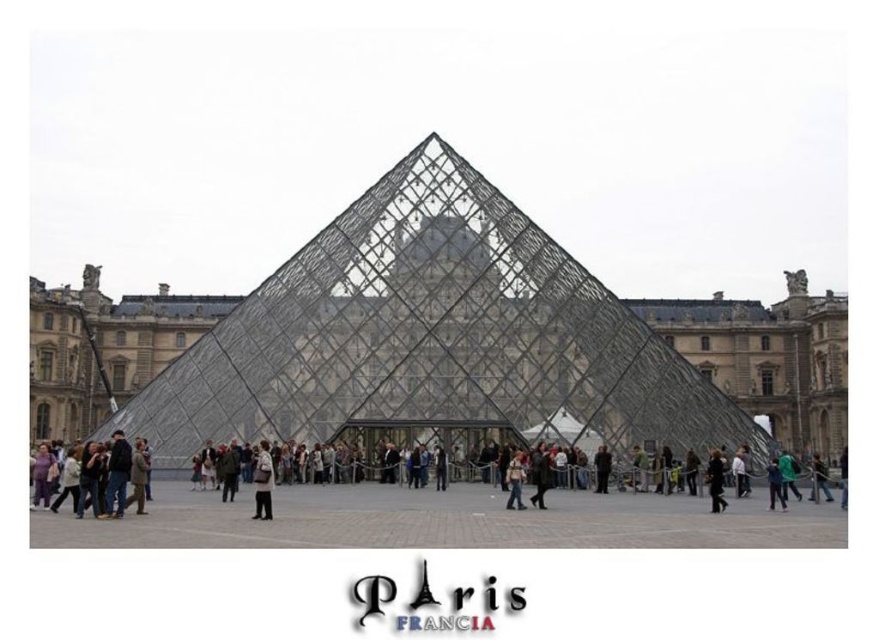
Question: In this image, where is black fabric coat at lower right located relative to dark gray fabric jacket at lower right?

Choices:
 (A) below
 (B) above

Answer: (B)

Question: Is dark blue jeans at center bigger than black fabric jacket at center?

Choices:
 (A) yes
 (B) no

Answer: (A)

Question: Which object is closer to the camera taking this photo?

Choices:
 (A) dark blue jeans at center
 (B) transparent glass pyramid at center
 (C) white fabric bag at center
 (D) dark gray jacket at center

Answer: (C)

Question: Which of the following is the farthest from the observer?

Choices:
 (A) dark gray jacket at center
 (B) white fabric bag at center

Answer: (A)

Question: Is dark blue jeans at center positioned in front of black fabric jacket at center?

Choices:
 (A) yes
 (B) no

Answer: (A)

Question: Considering the real-world distances, which object is closest to the black fabric coat at lower right?

Choices:
 (A) black fabric jacket at center
 (B) denim jacket at center
 (C) dark blue jeans at center
 (D) white fabric bag at center

Answer: (C)